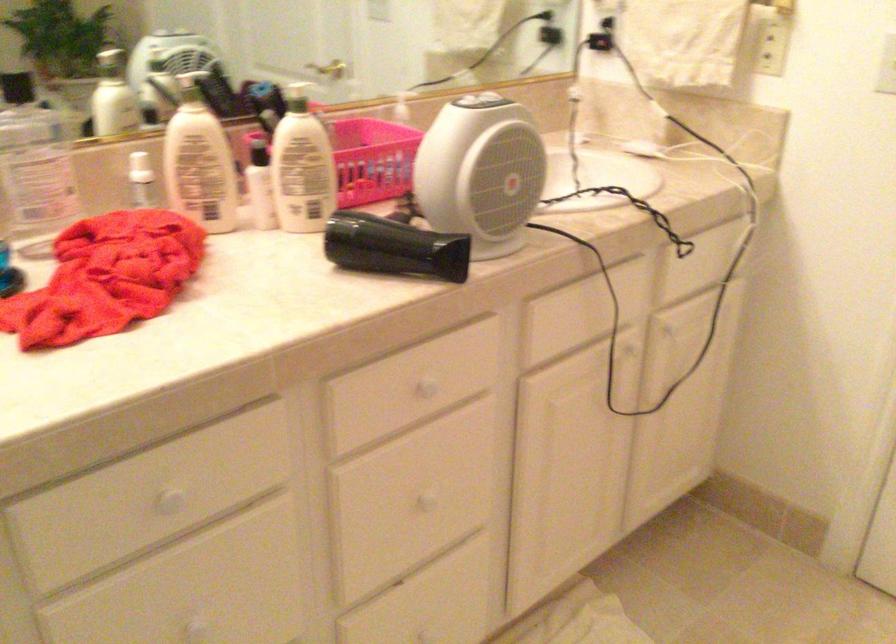
Describe the element at coordinates (113, 97) in the screenshot. The image size is (896, 644). I see `a bottle push cap` at that location.